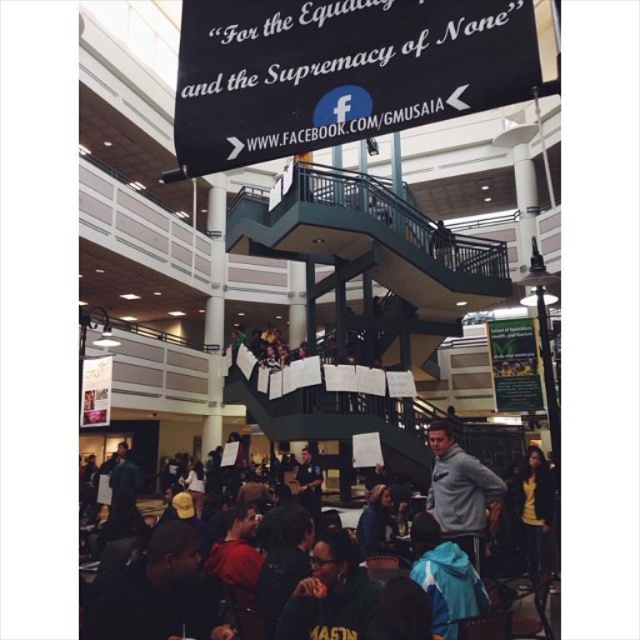
Can you confirm if black fabric sign at upper center is wider than dark gray hoodie at center?

No, black fabric sign at upper center is not wider than dark gray hoodie at center.

Does point (368, 35) come in front of point (260, 609)?

That is True.

Does point (483, 44) come farther from viewer compared to point (508, 556)?

That is False.

Locate an element on the screen. black fabric sign at upper center is located at coordinates (339, 72).

This screenshot has width=640, height=640. Find the location of `black fabric sign at upper center`. black fabric sign at upper center is located at coordinates (339, 72).

Can you confirm if black fabric sign at upper center is shorter than dark brown leather jacket at lower left?

Indeed, black fabric sign at upper center has a lesser height compared to dark brown leather jacket at lower left.

Who is more forward, (339, 120) or (125, 604)?

Point (339, 120) is more forward.

The height and width of the screenshot is (640, 640). Find the location of `black fabric sign at upper center`. black fabric sign at upper center is located at coordinates (x=339, y=72).

Does black fabric sign at upper center appear on the left side of green jersey at lower center?

No, black fabric sign at upper center is not to the left of green jersey at lower center.

Which of these two, black fabric sign at upper center or green jersey at lower center, stands shorter?

Standing shorter between the two is green jersey at lower center.

Is point (396, 61) behind point (336, 570)?

No, (396, 61) is in front of (336, 570).

In order to click on black fabric sign at upper center in this screenshot , I will do `click(339, 72)`.